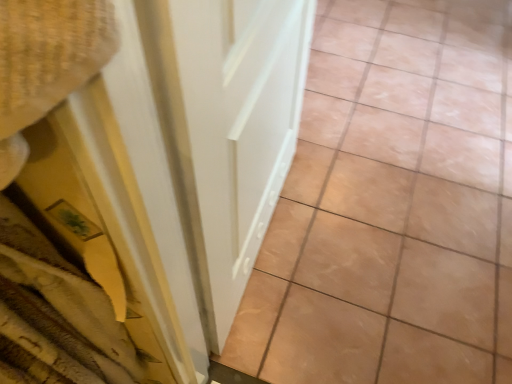
I want to click on free space below white glossy door at center (from a real-world perspective), so click(x=271, y=243).